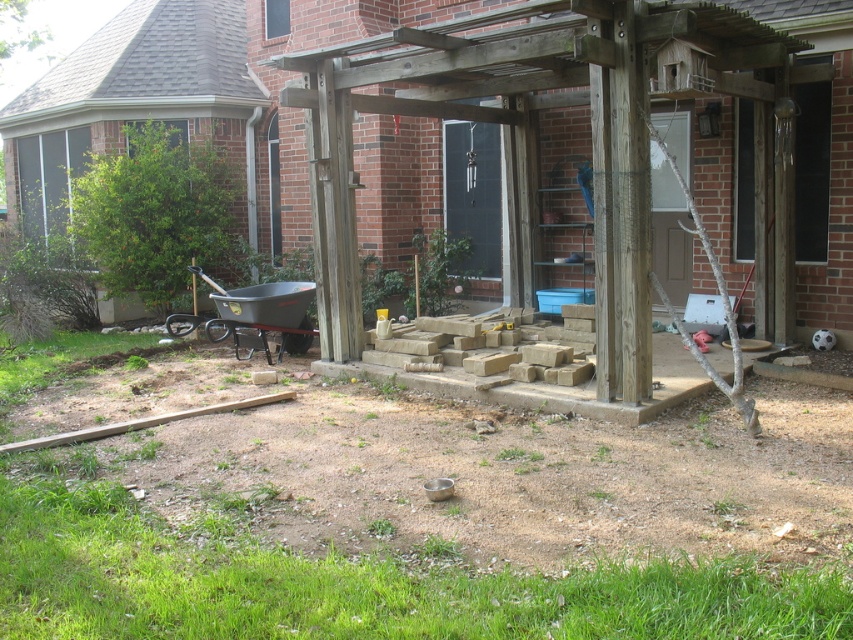
Question: Is wooden pergola at center to the right of brown concrete blocks at center from the viewer's perspective?

Choices:
 (A) no
 (B) yes

Answer: (B)

Question: Is wooden pergola at center smaller than brown concrete blocks at center?

Choices:
 (A) no
 (B) yes

Answer: (B)

Question: Is wooden pergola at center smaller than brown concrete blocks at center?

Choices:
 (A) yes
 (B) no

Answer: (A)

Question: Which object is farther from the camera taking this photo?

Choices:
 (A) wooden pergola at center
 (B) brown concrete blocks at center

Answer: (B)

Question: Among these points, which one is farthest from the camera?

Choices:
 (A) (602, 342)
 (B) (437, 384)

Answer: (B)